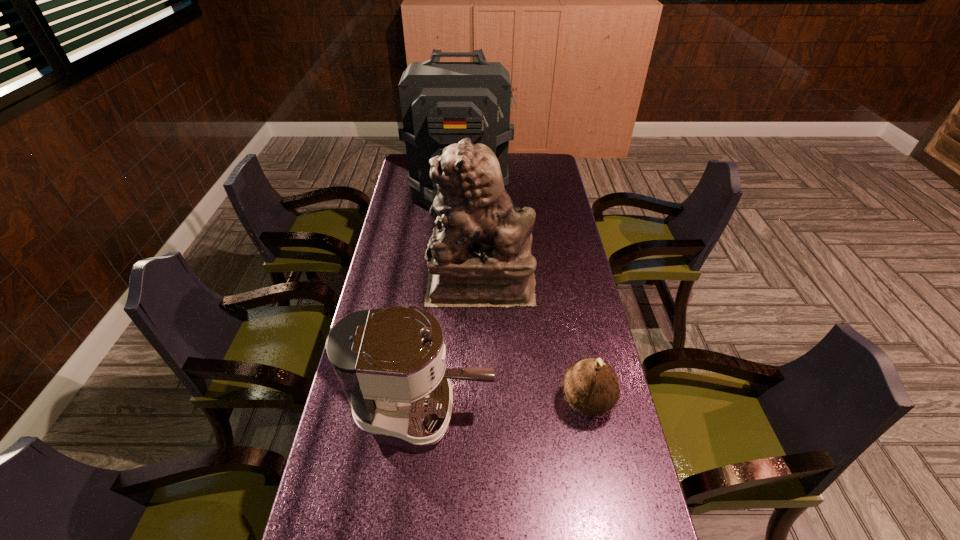
You are a GUI agent. You are given a task and a screenshot of the screen. Output one action in this format:
    pyautogui.click(x=<x>, y=<y>)
    Task: Click on the backpack
    
    Given the screenshot: What is the action you would take?
    pyautogui.click(x=442, y=103)

I want to click on sculpture, so click(479, 254).

Locate an element on the screen. The height and width of the screenshot is (540, 960). coffee maker is located at coordinates (390, 363).

Find the location of `the rightmost object`. the rightmost object is located at coordinates (591, 386).

The height and width of the screenshot is (540, 960). What are the coordinates of `the shortest object` in the screenshot? It's located at (591, 386).

The width and height of the screenshot is (960, 540). I want to click on blank space located 0.190m on the front compartment of the backpack, so click(457, 250).

The image size is (960, 540). I want to click on vacant space situated 0.130m on the front-facing side of the sculpture, so click(390, 282).

I want to click on vacant region located on the front-facing side of the sculpture, so click(x=398, y=282).

The image size is (960, 540). Find the location of `free spot located 0.090m on the front-facing side of the sculpture`. free spot located 0.090m on the front-facing side of the sculpture is located at coordinates (401, 282).

I want to click on vacant region located 0.330m on the front-facing side of the second shortest object, so click(615, 409).